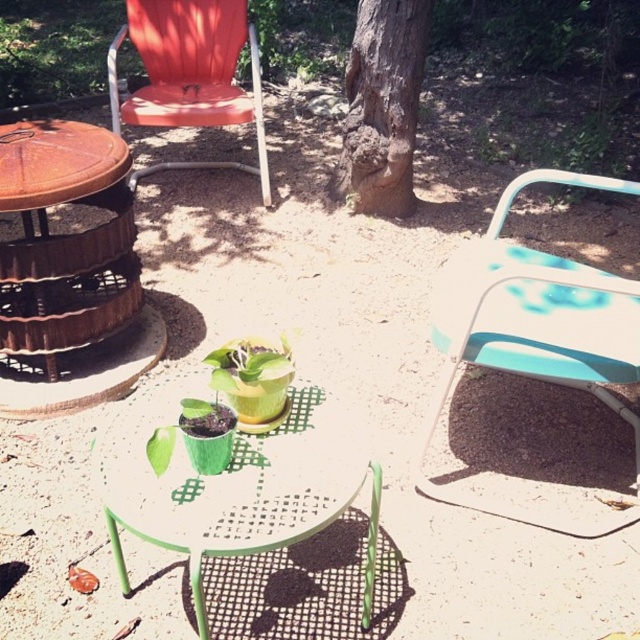
Does orange plastic chair at upper left have a greater width compared to brown rough bark tree at center?

Correct, the width of orange plastic chair at upper left exceeds that of brown rough bark tree at center.

Who is shorter, orange plastic chair at upper left or brown rough bark tree at center?

brown rough bark tree at center is shorter.

Between point (214, 44) and point (369, 141), which one is positioned behind?

Positioned behind is point (214, 44).

Identify the location of orange plastic chair at upper left. (189, 74).

Is green matte plant pot at center further to the viewer compared to brown rough bark tree at center?

That is False.

Is green matte plant pot at center above brown rough bark tree at center?

No.

You are a GUI agent. You are given a task and a screenshot of the screen. Output one action in this format:
    pyautogui.click(x=<x>, y=<y>)
    Task: Click on the green matte plant pot at center
    
    Given the screenshot: What is the action you would take?
    pyautogui.click(x=236, y=484)

The width and height of the screenshot is (640, 640). I want to click on green matte plant pot at center, so click(236, 484).

Is green matte plant pot at center positioned in front of teal plastic folding chair at upper right?

Yes, green matte plant pot at center is in front of teal plastic folding chair at upper right.

Image resolution: width=640 pixels, height=640 pixels. I want to click on green matte plant pot at center, so click(x=236, y=484).

What do you see at coordinates (236, 484) in the screenshot? I see `green matte plant pot at center` at bounding box center [236, 484].

The image size is (640, 640). Find the location of `green matte plant pot at center`. green matte plant pot at center is located at coordinates (236, 484).